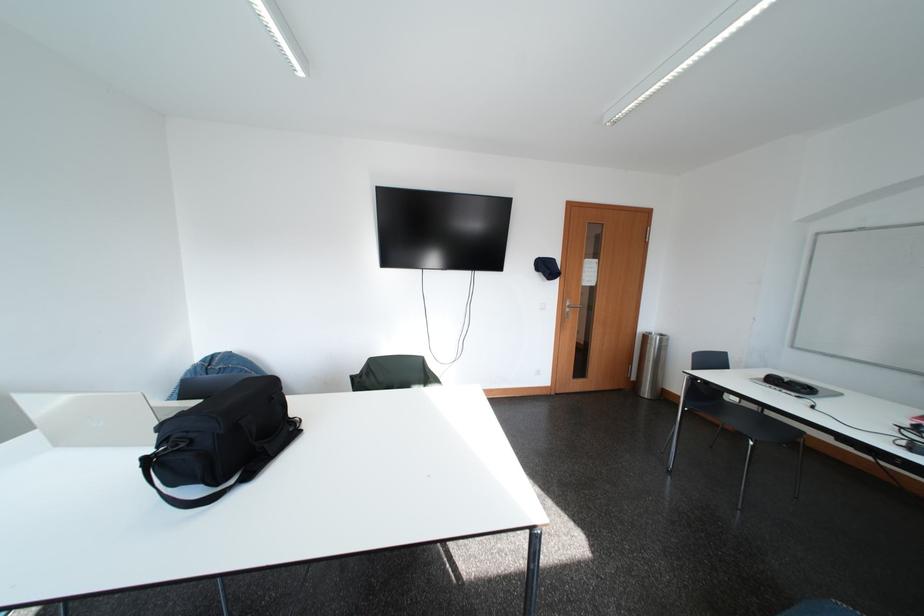
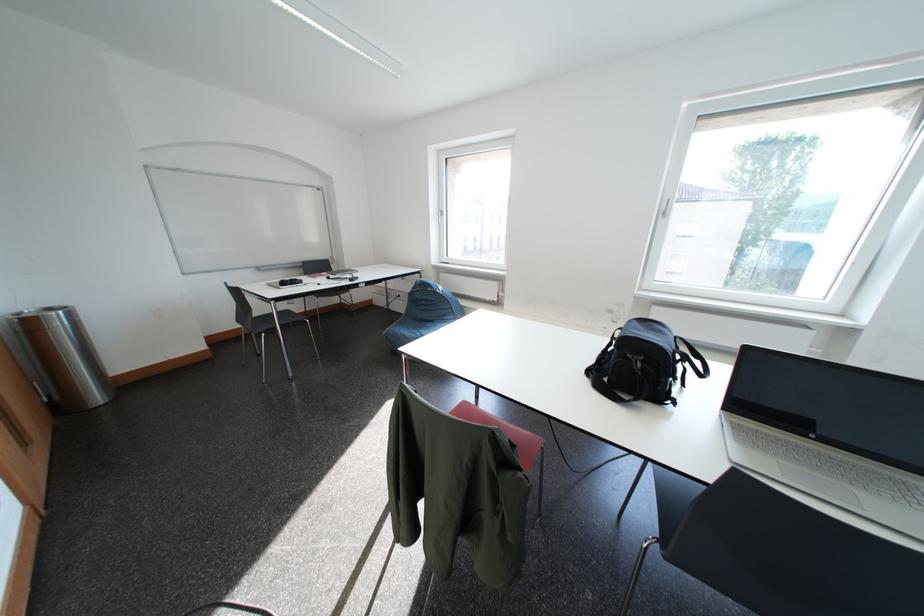
Find the pixel in the second image that matches (x=673, y=339) in the first image.

(59, 312)